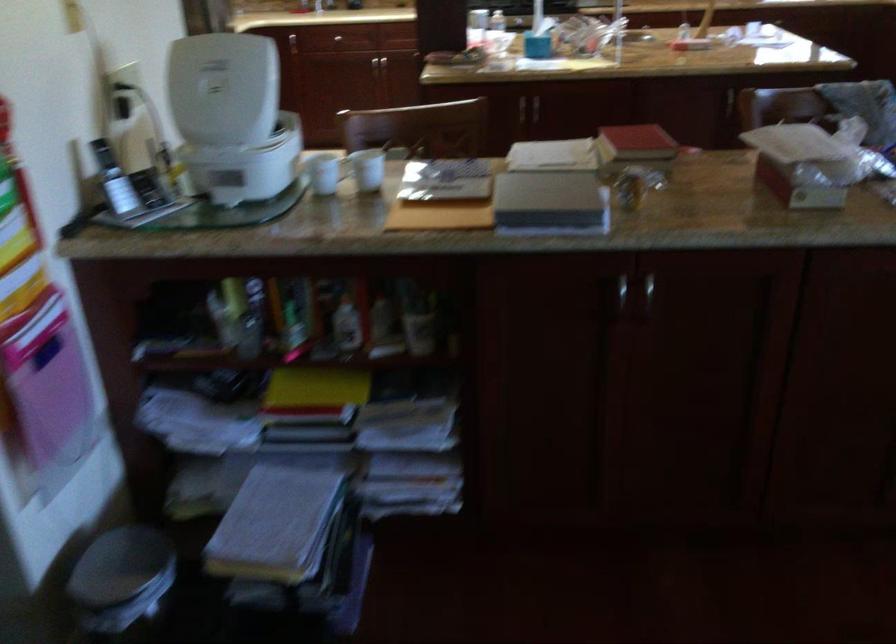
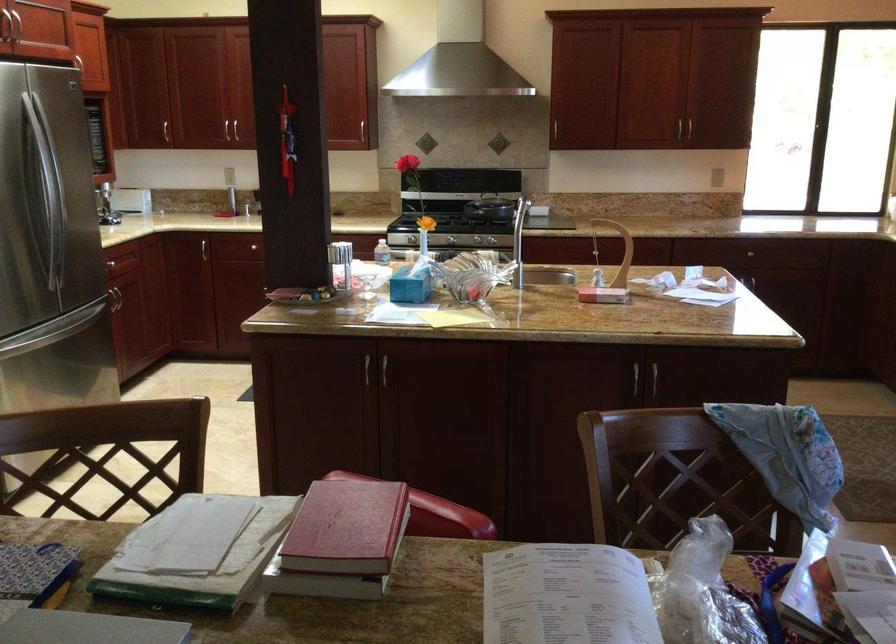
Question: I am providing you with two images of the same scene from different viewpoints. Which of the following objects are not visible in image2?

Choices:
 (A) black stove knob
 (B) refrigerator door handle
 (C) blue tissue box
 (D) none of these

Answer: (D)